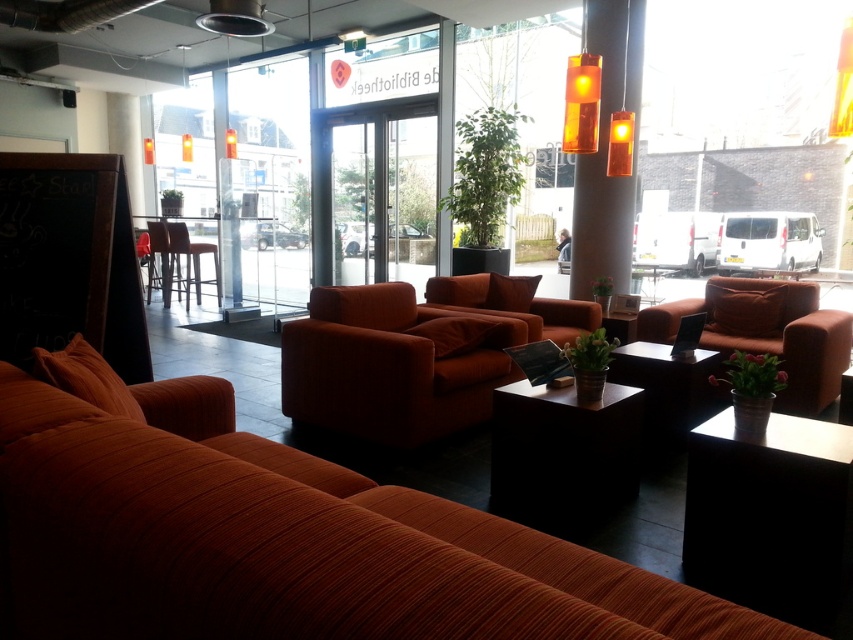
You are standing in the lounge and want to place a 2.5 feet wide plant on the black matte table at center. Can you determine if the table is wide enough to accommodate the plant?

The black matte table at center is 7.79 feet away from the viewer, but the description does not provide the table width. Therefore, it is impossible to determine if the table is wide enough to hold the plant.

You are standing at the entrance of the lounge and want to place a decorative plant on the black matte table at lower right. Based on the coordinates provided in the description, can you determine the exact location of the table relative to the entrance?

The black matte table at lower right is located at coordinates point [770,516], which places it near the lower right corner of the space. Since you are entering from the entrance, the table would be positioned to your right and slightly ahead, making it easy to locate once you enter the room.

You are a person sitting on the brown leather bar stool at center and want to place a book on the black matte table at lower right. Can you reach the table without moving from your current position?

The black matte table at lower right is to the right of the brown leather bar stool at center, so you can reach it without moving from your current position.